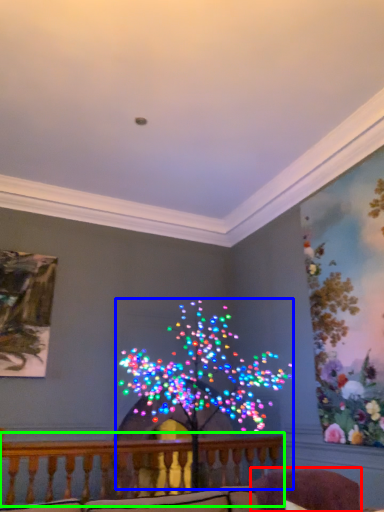
Question: Which is farther away from swivel chair (highlighted by a red box)? christmas decoration (highlighted by a blue box) or balcony (highlighted by a green box)?

Choices:
 (A) christmas decoration
 (B) balcony

Answer: (B)